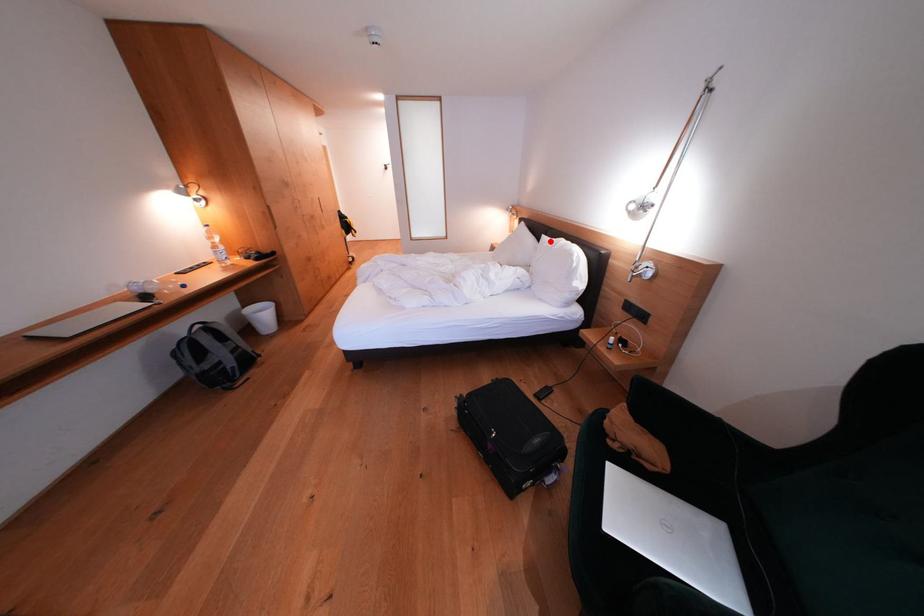
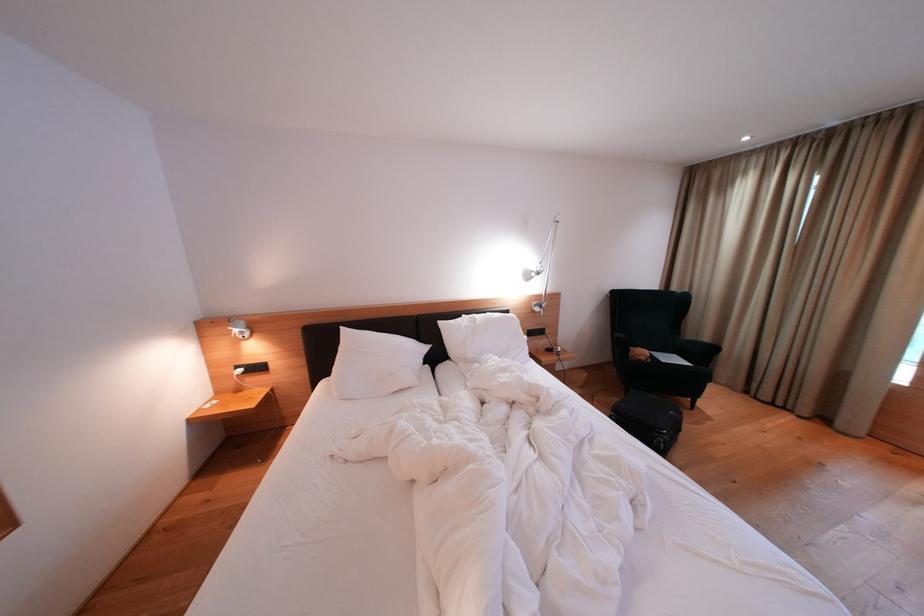
Where in the second image is the point corresponding to the highlighted location from the first image?

(447, 328)